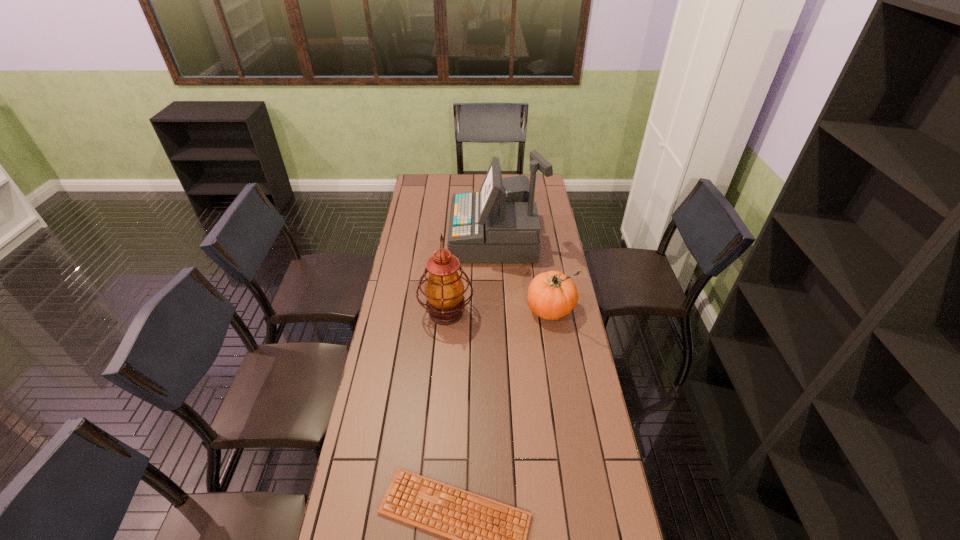
At what (x,y) coordinates should I click in order to perform the action: click on object that is the third closest one to the oil lamp. Please return your answer as a coordinate pair (x, y). Looking at the image, I should click on (487, 539).

The height and width of the screenshot is (540, 960). I want to click on the third closest object to the second shortest object, so click(487, 539).

Locate an element on the screen. This screenshot has height=540, width=960. free location that satisfies the following two spatial constraints: 1. on the customer-facing side of the farthest object; 2. on the right side of the third tallest object is located at coordinates (498, 308).

Find the location of `free space that satisfies the following two spatial constraints: 1. on the customer-facing side of the farthest object; 2. on the left side of the pumpkin`. free space that satisfies the following two spatial constraints: 1. on the customer-facing side of the farthest object; 2. on the left side of the pumpkin is located at coordinates (498, 308).

Locate an element on the screen. The width and height of the screenshot is (960, 540). blank area in the image that satisfies the following two spatial constraints: 1. on the back side of the third tallest object; 2. on the right side of the oil lamp is located at coordinates (446, 308).

This screenshot has height=540, width=960. What are the coordinates of `vacant space that satisfies the following two spatial constraints: 1. on the customer-facing side of the pumpkin; 2. on the left side of the farthest object` in the screenshot? It's located at (498, 308).

What are the coordinates of `vacant space that satisfies the following two spatial constraints: 1. on the customer-facing side of the cash register; 2. on the front side of the oil lamp` in the screenshot? It's located at (499, 313).